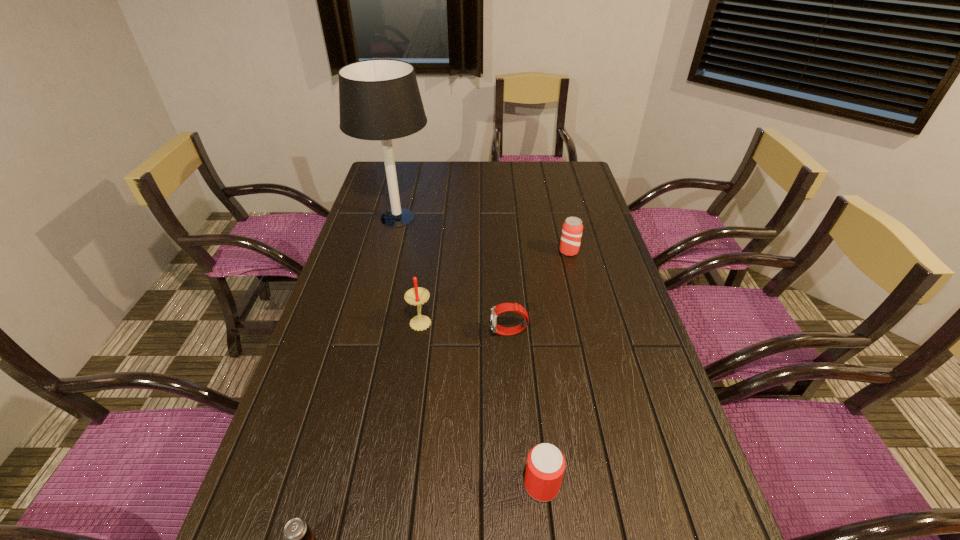
You are a GUI agent. You are given a task and a screenshot of the screen. Output one action in this format:
    pyautogui.click(x=<x>, y=<y>)
    Task: Click on the free space located on the back of the rightmost object
    
    Given the screenshot: What is the action you would take?
    pyautogui.click(x=554, y=191)

Find the location of a particular element. The height and width of the screenshot is (540, 960). vacant space located 0.050m on the front of the second nearest beer can is located at coordinates (546, 531).

You are a GUI agent. You are given a task and a screenshot of the screen. Output one action in this format:
    pyautogui.click(x=<x>, y=<y>)
    Task: Click on the free space located on the face of the watch
    
    Given the screenshot: What is the action you would take?
    pyautogui.click(x=465, y=333)

In order to click on vacant space positioned 0.320m on the face of the watch in this screenshot , I will do `click(372, 333)`.

I want to click on free space located 0.220m on the face of the watch, so click(x=410, y=333).

Image resolution: width=960 pixels, height=540 pixels. What are the coordinates of `object located in the left edge section of the desktop` in the screenshot? It's located at (379, 99).

Identify the location of object present at the right edge. The height and width of the screenshot is (540, 960). tap(572, 228).

Image resolution: width=960 pixels, height=540 pixels. In the image, there is a desktop. What are the coordinates of `vacant space at the far edge` in the screenshot? It's located at (492, 161).

In the image, there is a desktop. What are the coordinates of `vacant space at the left edge` in the screenshot? It's located at (310, 413).

In the image, there is a desktop. Identify the location of vacant space at the far left corner. The width and height of the screenshot is (960, 540). (399, 184).